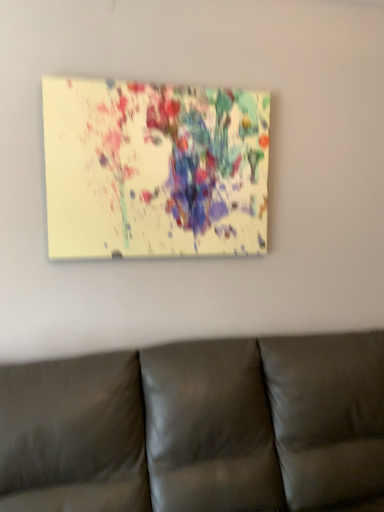
Question: From a real-world perspective, is matte acrylic painting at upper center physically located above or below leather couch at lower center?

Choices:
 (A) below
 (B) above

Answer: (B)

Question: From their relative heights in the image, would you say matte acrylic painting at upper center is taller or shorter than leather couch at lower center?

Choices:
 (A) short
 (B) tall

Answer: (A)

Question: Considering the positions of matte acrylic painting at upper center and leather couch at lower center in the image, is matte acrylic painting at upper center bigger or smaller than leather couch at lower center?

Choices:
 (A) small
 (B) big

Answer: (A)

Question: Is leather couch at lower center inside or outside of matte acrylic painting at upper center?

Choices:
 (A) outside
 (B) inside

Answer: (A)

Question: Is leather couch at lower center taller or shorter than matte acrylic painting at upper center?

Choices:
 (A) short
 (B) tall

Answer: (B)

Question: Considering the positions of leather couch at lower center and matte acrylic painting at upper center in the image, is leather couch at lower center bigger or smaller than matte acrylic painting at upper center?

Choices:
 (A) big
 (B) small

Answer: (A)

Question: From a real-world perspective, is leather couch at lower center positioned above or below matte acrylic painting at upper center?

Choices:
 (A) below
 (B) above

Answer: (A)